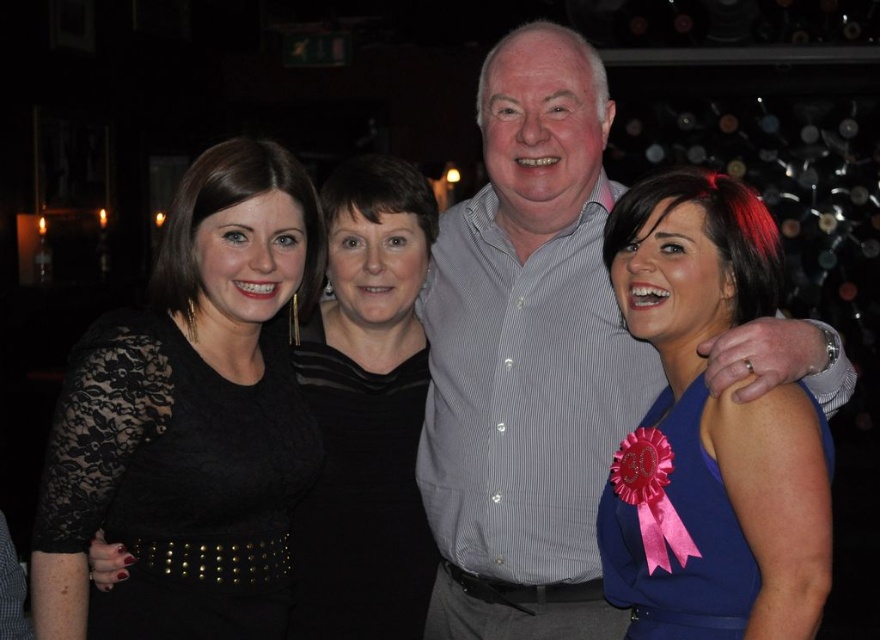
You are a photographer trying to adjust the lighting for a group photo. You notice two dresses in the scene, the lace fabric dress at left and the black lace dress at center. Which dress is positioned higher in the frame?

The lace fabric dress at left is positioned higher in the frame than the black lace dress at center.

You are standing in a social setting where a group of four people are posing for a photo. You notice a specific point at coordinates point (744, 337). Can you estimate how far this point is from your current position?

The point (744, 337) is 7.09 feet away from the viewer.